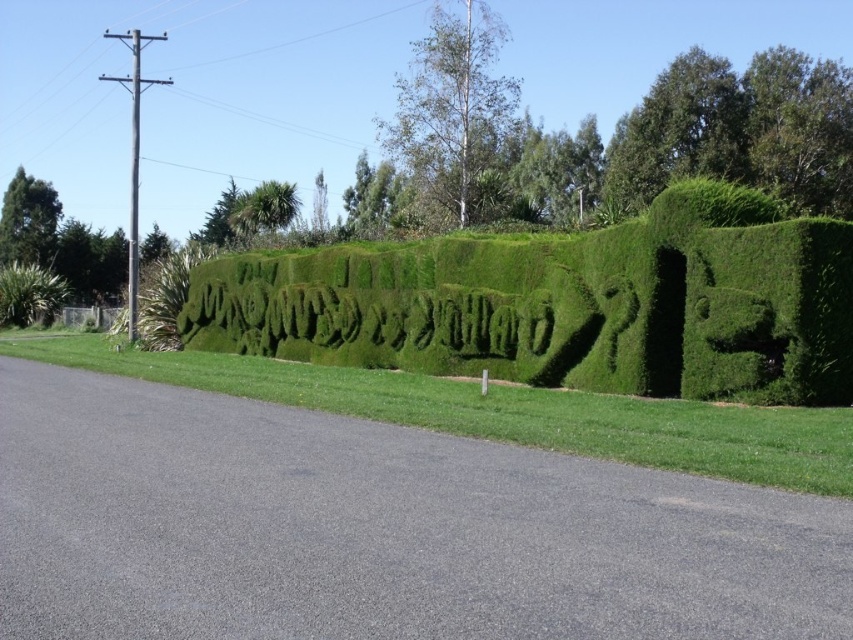
Does green hedge at center appear under green leafy shrub at left?

Yes, green hedge at center is below green leafy shrub at left.

What do you see at coordinates (509, 412) in the screenshot?
I see `green hedge at center` at bounding box center [509, 412].

Is point (286, 400) more distant than point (54, 296)?

No, (286, 400) is in front of (54, 296).

The image size is (853, 640). Identify the location of green hedge at center. (509, 412).

Which of these two, green grass hedge at center or green leafy shrub at left, stands shorter?

Standing shorter between the two is green grass hedge at center.

Is green grass hedge at center wider than green leafy shrub at left?

Correct, the width of green grass hedge at center exceeds that of green leafy shrub at left.

Measure the distance between green grass hedge at center and camera.

green grass hedge at center and camera are 40.24 feet apart from each other.

What are the coordinates of `green grass hedge at center` in the screenshot? It's located at click(566, 304).

Does green grass hedge at center have a greater height compared to green hedge at center?

Indeed, green grass hedge at center has a greater height compared to green hedge at center.

Who is more forward, [485,282] or [728,468]?

Point [728,468]

The height and width of the screenshot is (640, 853). I want to click on green grass hedge at center, so click(x=566, y=304).